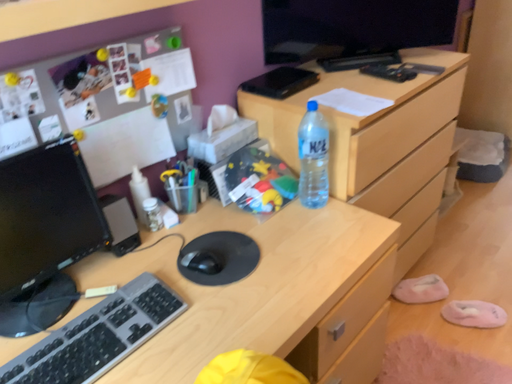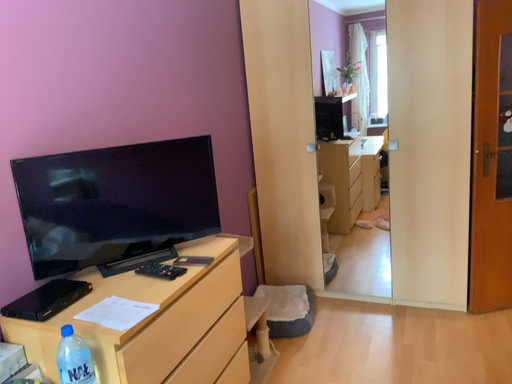
Question: Which way did the camera rotate in the video?

Choices:
 (A) rotated right
 (B) rotated left

Answer: (A)